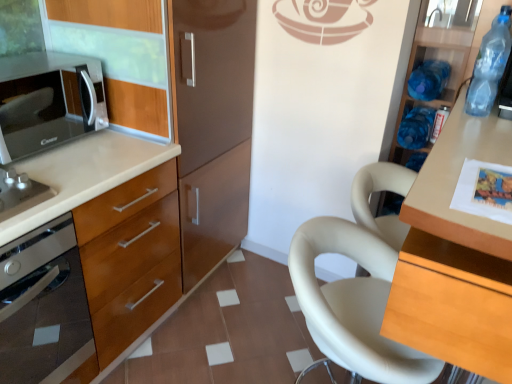
At what (x,y) coordinates should I click in order to perform the action: click on light wood table at right, placed as the 2th cabinetry when sorted from left to right. Please return your answer as a coordinate pair (x, y). The image size is (512, 384). Looking at the image, I should click on (455, 258).

How much space does blue plastic bottle at right, the third bottle when ordered from front to back, occupy vertically?

It is 5.54 inches.

What do you see at coordinates (353, 303) in the screenshot? This screenshot has width=512, height=384. I see `white leather chair at center` at bounding box center [353, 303].

Identify the location of blue plastic bottle at upper right, which ranks as the second bottle in back-to-front order. This screenshot has width=512, height=384. [429, 80].

Image resolution: width=512 pixels, height=384 pixels. What are the coordinates of `light wood table at right, marked as the 1th cabinetry in a right-to-left arrangement` in the screenshot? It's located at (455, 258).

Considering the positions of objects black glossy microwave at left and satin silver oven at left in the image provided, who is more to the left, black glossy microwave at left or satin silver oven at left?

satin silver oven at left.

Considering the sizes of black glossy microwave at left and satin silver oven at left in the image, is black glossy microwave at left bigger or smaller than satin silver oven at left?

In the image, black glossy microwave at left appears to be smaller than satin silver oven at left.

Considering the positions of point (18, 77) and point (72, 307), is point (18, 77) closer or farther from the camera than point (72, 307)?

Clearly, point (18, 77) is more distant from the camera than point (72, 307).

From the image's perspective, is black glossy microwave at left located beneath satin silver oven at left?

Incorrect, from the image's perspective, black glossy microwave at left is higher than satin silver oven at left.

Is point (424, 90) positioned in front of point (86, 73)?

No, (424, 90) is further to viewer.

Is blue plastic bottle at upper right, the 2th bottle from the front, not within black glossy microwave at left?

Yes, blue plastic bottle at upper right, the 2th bottle from the front, is located beyond the bounds of black glossy microwave at left.

Looking at this image, can you see blue plastic bottle at upper right, the 2th bottle from the front, touching black glossy microwave at left?

No, blue plastic bottle at upper right, the 2th bottle from the front, is not beside black glossy microwave at left.

In terms of size, does blue plastic bottle at upper right, which ranks as the second bottle in back-to-front order, appear bigger or smaller than black glossy microwave at left?

In the image, blue plastic bottle at upper right, which ranks as the second bottle in back-to-front order, appears to be smaller than black glossy microwave at left.

Can you see wooden cabinet at left, which is the 1th cabinetry from left to right, touching light wood table at right, marked as the 1th cabinetry in a right-to-left arrangement?

No, wooden cabinet at left, which is the 1th cabinetry from left to right, is not beside light wood table at right, marked as the 1th cabinetry in a right-to-left arrangement.

Between wooden cabinet at left, which appears as the second cabinetry when viewed from the right, and light wood table at right, placed as the 2th cabinetry when sorted from left to right, which one has larger width?

wooden cabinet at left, which appears as the second cabinetry when viewed from the right, is wider.

From a real-world perspective, which is physically below, wooden cabinet at left, which appears as the second cabinetry when viewed from the right, or light wood table at right, placed as the 2th cabinetry when sorted from left to right?

wooden cabinet at left, which appears as the second cabinetry when viewed from the right, from a real-world perspective.

Looking at this image, from the image's perspective, between wooden cabinet at left, which is the 1th cabinetry from left to right, and satin silver oven at left, who is located below?

satin silver oven at left appears lower in the image.

From a real-world perspective, is wooden cabinet at left, which is the 1th cabinetry from left to right, physically above satin silver oven at left?

Incorrect, from a real-world perspective, wooden cabinet at left, which is the 1th cabinetry from left to right, is lower than satin silver oven at left.

Locate an element on the screen. The width and height of the screenshot is (512, 384). home appliance below the wooden cabinet at left, which appears as the second cabinetry when viewed from the right (from the image's perspective) is located at coordinates (42, 306).

Between wooden cabinet at left, which appears as the second cabinetry when viewed from the right, and satin silver oven at left, which one has smaller width?

With smaller width is satin silver oven at left.

Is satin silver oven at left touching wooden cabinet at left, which is the 1th cabinetry from left to right?

No, satin silver oven at left is not touching wooden cabinet at left, which is the 1th cabinetry from left to right.

Is satin silver oven at left thinner than wooden cabinet at left, which appears as the second cabinetry when viewed from the right?

Yes.

Is satin silver oven at left oriented towards wooden cabinet at left, which appears as the second cabinetry when viewed from the right?

Yes, satin silver oven at left is turned towards wooden cabinet at left, which appears as the second cabinetry when viewed from the right.

Can you confirm if light wood table at right, placed as the 2th cabinetry when sorted from left to right, is smaller than blue plastic bottle at upper right, which ranks as the second bottle in back-to-front order?

No, light wood table at right, placed as the 2th cabinetry when sorted from left to right, is not smaller than blue plastic bottle at upper right, which ranks as the second bottle in back-to-front order.

From a real-world perspective, is light wood table at right, marked as the 1th cabinetry in a right-to-left arrangement, physically located above or below blue plastic bottle at upper right, the 2th bottle from the front?

light wood table at right, marked as the 1th cabinetry in a right-to-left arrangement, is situated lower than blue plastic bottle at upper right, the 2th bottle from the front, in the real world.

In the image, is light wood table at right, marked as the 1th cabinetry in a right-to-left arrangement, positioned in front of or behind blue plastic bottle at upper right, the 2th bottle from the front?

In the image, light wood table at right, marked as the 1th cabinetry in a right-to-left arrangement, appears in front of blue plastic bottle at upper right, the 2th bottle from the front.

Is light wood table at right, marked as the 1th cabinetry in a right-to-left arrangement, directly adjacent to blue plastic bottle at upper right, the 2th bottle from the front?

No, light wood table at right, marked as the 1th cabinetry in a right-to-left arrangement, is not touching blue plastic bottle at upper right, the 2th bottle from the front.

From the image's perspective, which object appears higher, satin silver oven at left or light wood table at right, placed as the 2th cabinetry when sorted from left to right?

satin silver oven at left is shown above in the image.

Does satin silver oven at left have a greater height compared to light wood table at right, marked as the 1th cabinetry in a right-to-left arrangement?

In fact, satin silver oven at left may be shorter than light wood table at right, marked as the 1th cabinetry in a right-to-left arrangement.

Which point is more forward, (12, 291) or (504, 289)?

Positioned in front is point (504, 289).

You are a GUI agent. You are given a task and a screenshot of the screen. Output one action in this format:
    pyautogui.click(x=<x>, y=<y>)
    Task: Click on the home appliance that appears below the black glossy microwave at left (from a real-world perspective)
    The image size is (512, 384).
    Given the screenshot: What is the action you would take?
    pyautogui.click(x=42, y=306)

Locate an element on the screen. microwave oven below the blue plastic bottle at upper right, the 2th bottle from the front (from the image's perspective) is located at coordinates (48, 101).

When comparing their distances from blue plastic bottle at upper right, which ranks as the second bottle in back-to-front order, does black glossy microwave at left or blue translucent bottle at upper right, which is the 3th bottle in back-to-front order, seem further?

Based on the image, black glossy microwave at left appears to be further to blue plastic bottle at upper right, which ranks as the second bottle in back-to-front order.

When comparing their distances from white leather chair at center, does light wood table at right, marked as the 1th cabinetry in a right-to-left arrangement, or blue plastic bottle at upper right, which ranks as the second bottle in back-to-front order, seem closer?

light wood table at right, marked as the 1th cabinetry in a right-to-left arrangement.

Which object lies further to the anchor point black glossy microwave at left, light wood table at right, marked as the 1th cabinetry in a right-to-left arrangement, or white leather chair at center?

The object further to black glossy microwave at left is light wood table at right, marked as the 1th cabinetry in a right-to-left arrangement.

Estimate the real-world distances between objects in this image. Which object is closer to black glossy microwave at left, white leather chair at center or blue plastic bottle at right, the third bottle when ordered from front to back?

white leather chair at center is closer to black glossy microwave at left.

Which object lies further to the anchor point white leather chair at center, wooden cabinet at left, which appears as the second cabinetry when viewed from the right, or black glossy microwave at left?

black glossy microwave at left is further to white leather chair at center.

Based on their spatial positions, is blue plastic bottle at right, the third bottle when ordered from front to back, or black glossy microwave at left further from satin silver oven at left?

Based on the image, blue plastic bottle at right, the third bottle when ordered from front to back, appears to be further to satin silver oven at left.

Based on their spatial positions, is white leather chair at center or black glossy microwave at left further from wooden cabinet at left, which is the 1th cabinetry from left to right?

Among the two, white leather chair at center is located further to wooden cabinet at left, which is the 1th cabinetry from left to right.

Estimate the real-world distances between objects in this image. Which object is closer to blue translucent bottle at upper right, placed as the first bottle when sorted from front to back, light wood table at right, marked as the 1th cabinetry in a right-to-left arrangement, or black glossy microwave at left?

Among the two, light wood table at right, marked as the 1th cabinetry in a right-to-left arrangement, is located nearer to blue translucent bottle at upper right, placed as the first bottle when sorted from front to back.

Locate an element on the screen. chair positioned between light wood table at right, placed as the 2th cabinetry when sorted from left to right, and blue plastic bottle at right, the third bottle when ordered from front to back, from near to far is located at coordinates (353, 303).

The height and width of the screenshot is (384, 512). Identify the location of cabinetry between black glossy microwave at left and blue plastic bottle at upper right, the 2th bottle from the front. (82, 175).

Where is `chair situated between black glossy microwave at left and light wood table at right, marked as the 1th cabinetry in a right-to-left arrangement, from left to right`? chair situated between black glossy microwave at left and light wood table at right, marked as the 1th cabinetry in a right-to-left arrangement, from left to right is located at coordinates pyautogui.click(x=353, y=303).

I want to click on cabinetry located between black glossy microwave at left and white leather chair at center in the left-right direction, so click(82, 175).